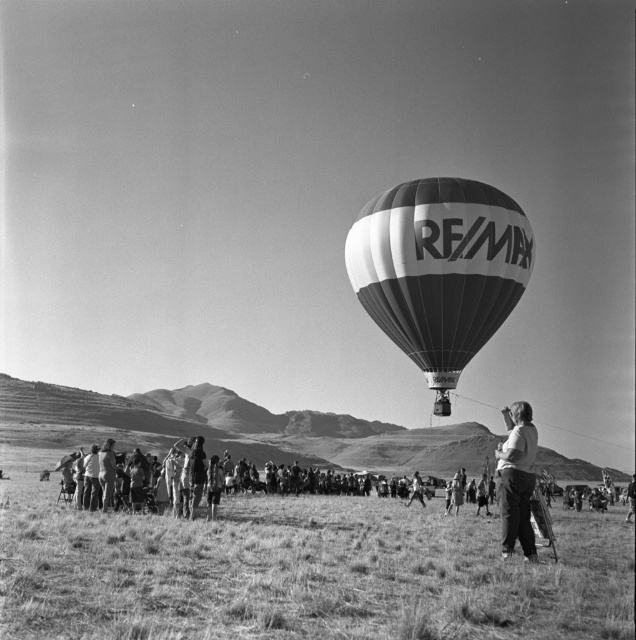
You are a photographer trying to capture a clear shot of the RE MAX hot air balloon in the middle right. You notice the grassy field at lower center and the dark gray pants at right in your frame. Which object is shorter in your view?

The grassy field at lower center is shorter than the dark gray pants at right.